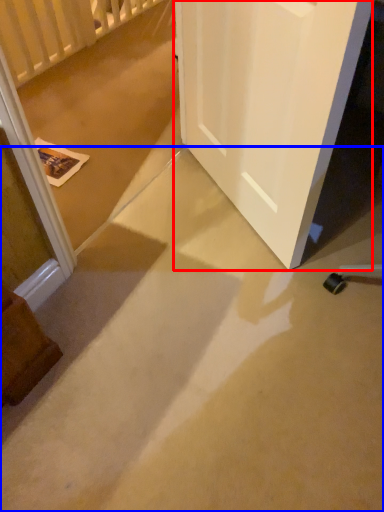
Question: Among these objects, which one is nearest to the camera, door (highlighted by a red box) or concrete (highlighted by a blue box)?

Choices:
 (A) door
 (B) concrete

Answer: (B)